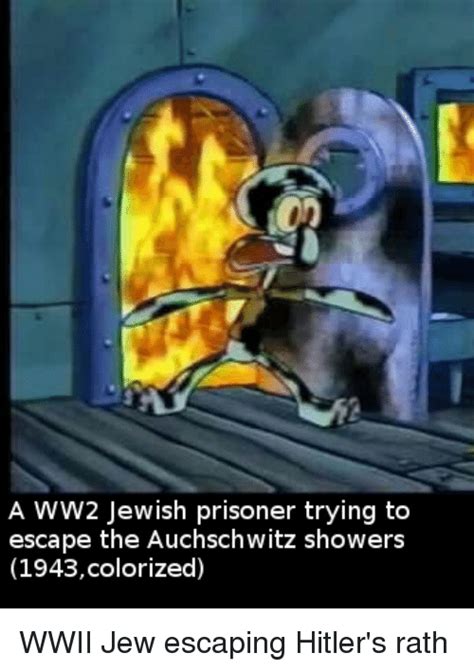
You are a GUI agent. You are given a task and a screenshot of the screen. Output one action in this format:
    pyautogui.click(x=<x>, y=<y>)
    Task: Click on the door
    
    Given the screenshot: What is the action you would take?
    pyautogui.click(x=354, y=280)